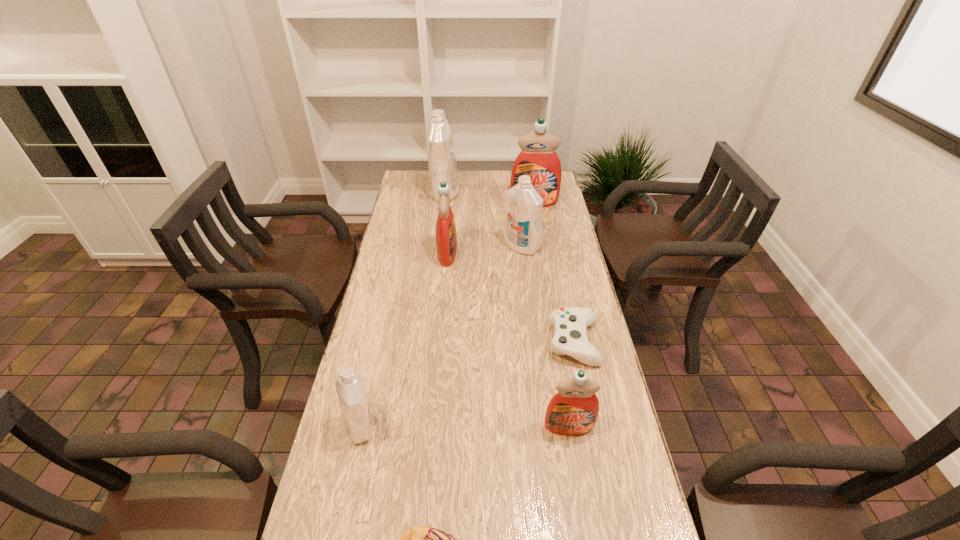
Locate an element on the screen. The height and width of the screenshot is (540, 960). control is located at coordinates click(570, 324).

At what (x,y) coordinates should I click in order to perform the action: click on the shortest object. Please return your answer as a coordinate pair (x, y). Looking at the image, I should click on (570, 324).

At what (x,y) coordinates should I click in order to perform the action: click on vacant point located on the right of the biggest white detergent. Please return your answer as a coordinate pair (x, y). The image size is (960, 540). Looking at the image, I should click on (508, 193).

The image size is (960, 540). In order to click on free spot located on the front surface of the biggest red detergent in this screenshot , I will do `click(544, 266)`.

Where is `free space located 0.280m on the back of the second nearest white detergent`? This screenshot has height=540, width=960. free space located 0.280m on the back of the second nearest white detergent is located at coordinates (516, 200).

Where is `vacant space located 0.380m on the front surface of the leftmost red detergent`? The image size is (960, 540). vacant space located 0.380m on the front surface of the leftmost red detergent is located at coordinates 558,254.

Where is `vacant space positioned on the right of the leftmost object`? The height and width of the screenshot is (540, 960). vacant space positioned on the right of the leftmost object is located at coordinates (404, 427).

This screenshot has height=540, width=960. I want to click on free space located on the front surface of the smallest red detergent, so click(x=574, y=456).

Identify the location of free region located 0.050m on the front of the fifth farthest object. This screenshot has width=960, height=540. (583, 384).

Image resolution: width=960 pixels, height=540 pixels. I want to click on object at the far edge, so click(441, 149).